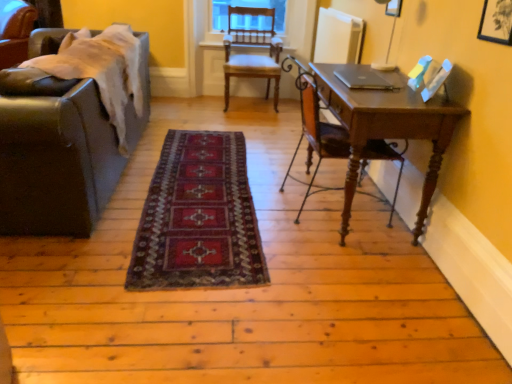
I want to click on vacant space in front of wooden desk at right, so click(x=353, y=277).